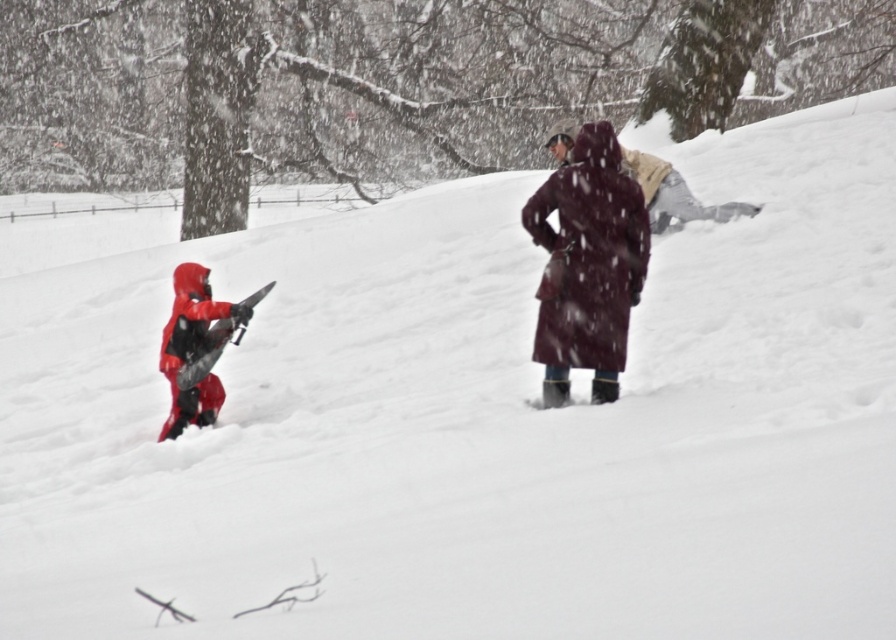
Question: Is velvet maroon coat at center below matte red snowsuit at left?

Choices:
 (A) yes
 (B) no

Answer: (B)

Question: In this image, where is velvet maroon coat at center located relative to matte red snowsuit at left?

Choices:
 (A) below
 (B) above

Answer: (B)

Question: Can you confirm if velvet maroon coat at center is wider than matte red snowsuit at left?

Choices:
 (A) no
 (B) yes

Answer: (B)

Question: Which point is farther to the camera?

Choices:
 (A) velvet maroon coat at center
 (B) matte red snowsuit at left

Answer: (B)